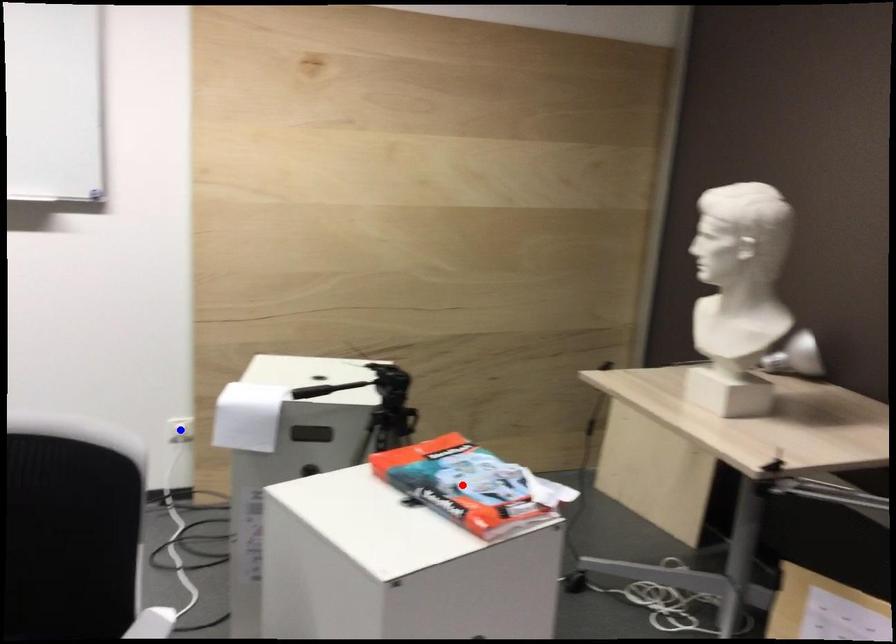
Question: Two points are marked on the image. Which point is closer to the camera?

Choices:
 (A) Blue point is closer.
 (B) Red point is closer.

Answer: (B)